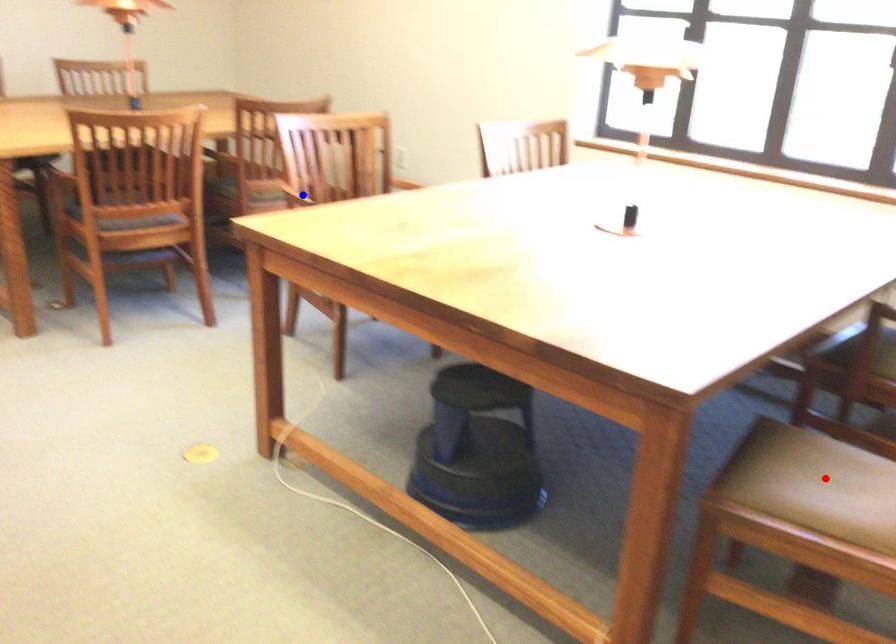
Question: In the image, two points are highlighted. Which point is nearer to the camera? Reply with the corresponding letter.

Choices:
 (A) blue point
 (B) red point

Answer: (B)